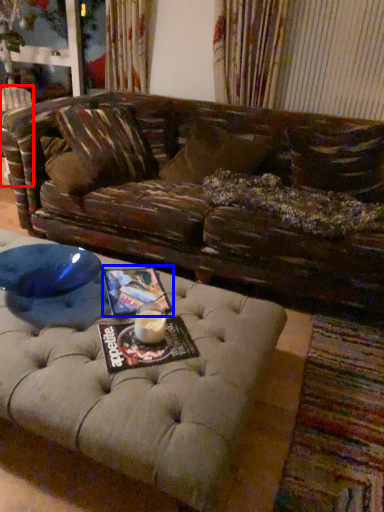
Question: Which point is further to the camera, swivel chair (highlighted by a red box) or magazine (highlighted by a blue box)?

Choices:
 (A) swivel chair
 (B) magazine

Answer: (A)